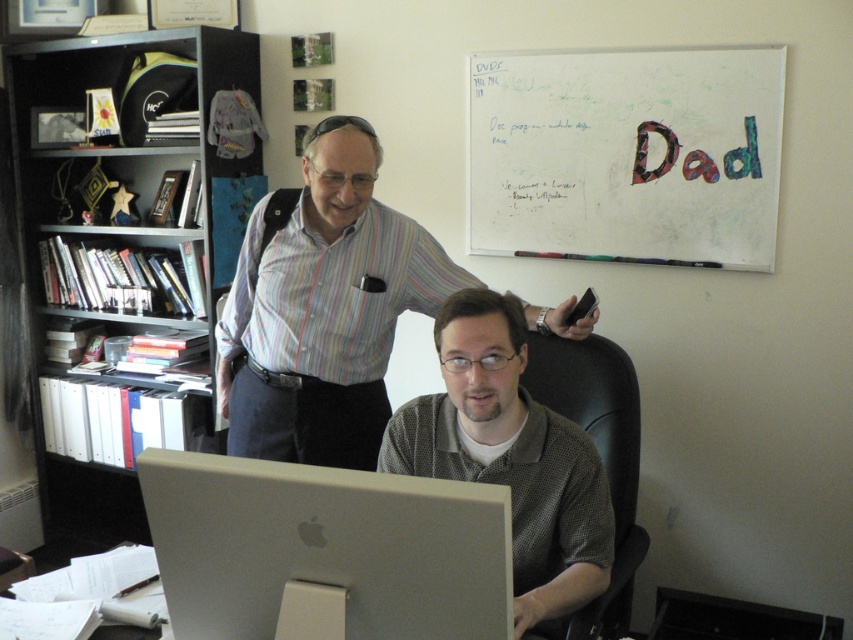
Could you measure the distance between whiteboard with colorful markers at upper right and striped cotton shirt at upper center?

26.79 inches

Which of these two, whiteboard with colorful markers at upper right or striped cotton shirt at upper center, stands shorter?

whiteboard with colorful markers at upper right is shorter.

Identify the location of whiteboard with colorful markers at upper right. (625, 156).

Can you confirm if whiteboard with colorful markers at upper right is positioned above silver metallic monitor at center?

Correct, whiteboard with colorful markers at upper right is located above silver metallic monitor at center.

Between point (726, 163) and point (407, 504), which one is positioned behind?

The point (726, 163) is behind.

Between point (610, 205) and point (171, 472), which one is positioned in front?

Point (171, 472) is more forward.

This screenshot has height=640, width=853. What are the coordinates of `whiteboard with colorful markers at upper right` in the screenshot? It's located at (625, 156).

Is black plastic bookshelf at left positioned in front of whiteboard with colorful markers at upper right?

No, black plastic bookshelf at left is behind whiteboard with colorful markers at upper right.

Is point (47, 488) positioned after point (527, 228)?

Yes, point (47, 488) is behind point (527, 228).

What are the coordinates of `black plastic bookshelf at left` in the screenshot? It's located at (131, 189).